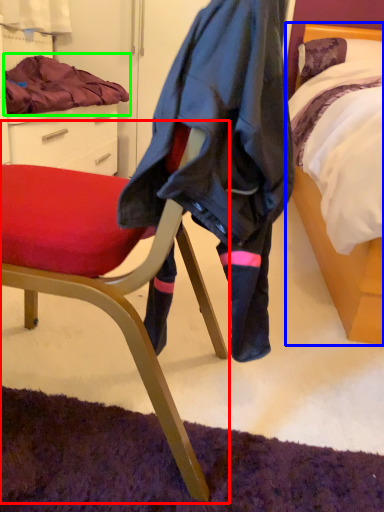
Question: Estimate the real-world distances between objects in this image. Which object is closer to chair (highlighted by a red box), bed (highlighted by a blue box) or blanket (highlighted by a green box)?

Choices:
 (A) bed
 (B) blanket

Answer: (A)